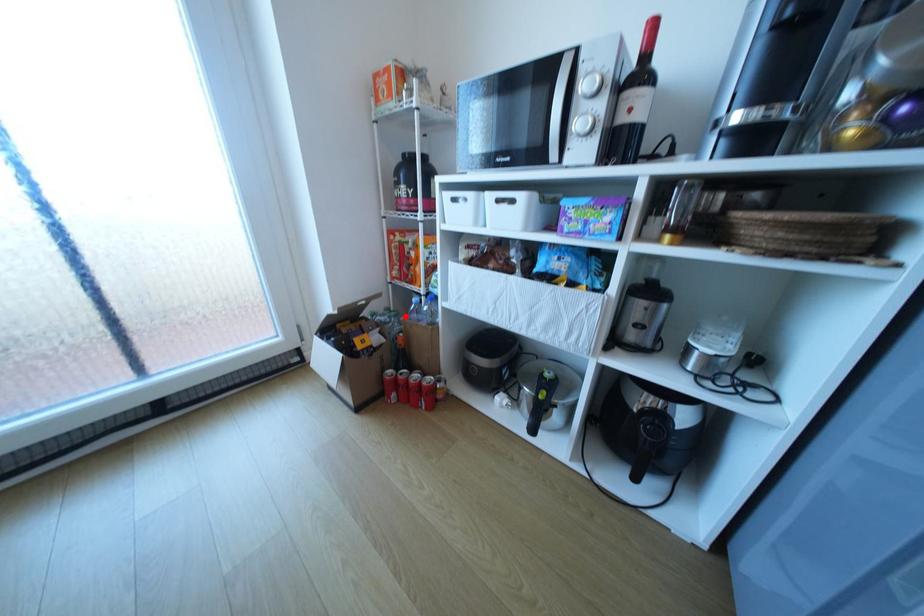
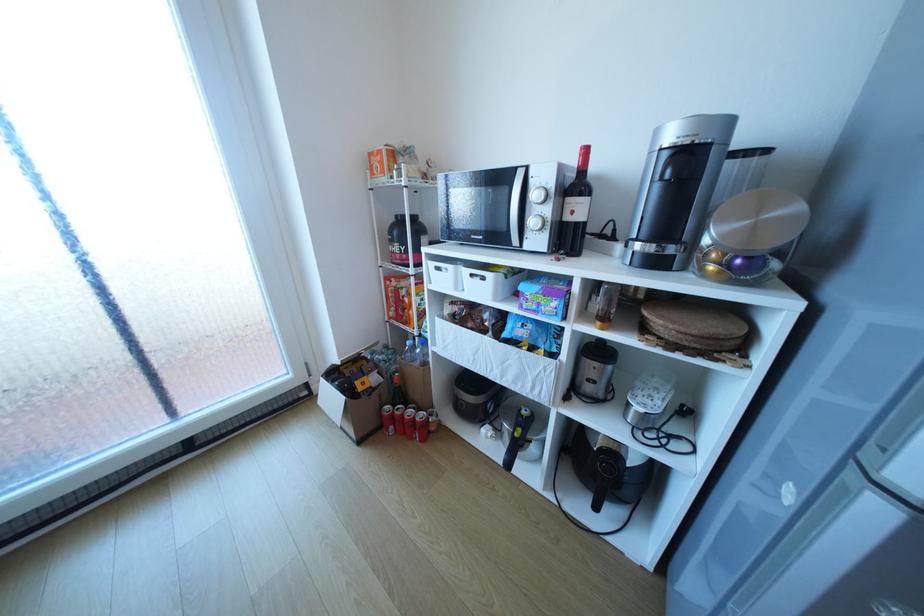
Question: I am providing you with two images of the same scene from different viewpoints. Given a red point in image1, look at the same physical point in image2. Is it:

Choices:
 (A) Closer to the viewpoint
 (B) Farther from the viewpoint

Answer: (B)